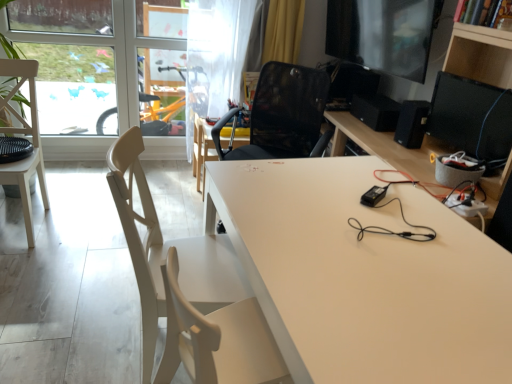
Identify the location of free region under white wood chair at left, positioned as the 2th chair in front-to-back order (from a real-world perspective). The image size is (512, 384). (18, 225).